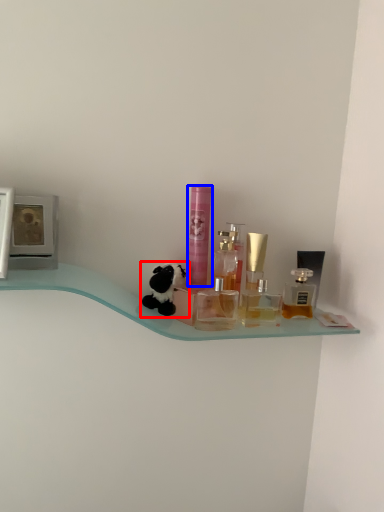
Question: Which object is further to the camera taking this photo, toy (highlighted by a red box) or toiletry (highlighted by a blue box)?

Choices:
 (A) toy
 (B) toiletry

Answer: (B)